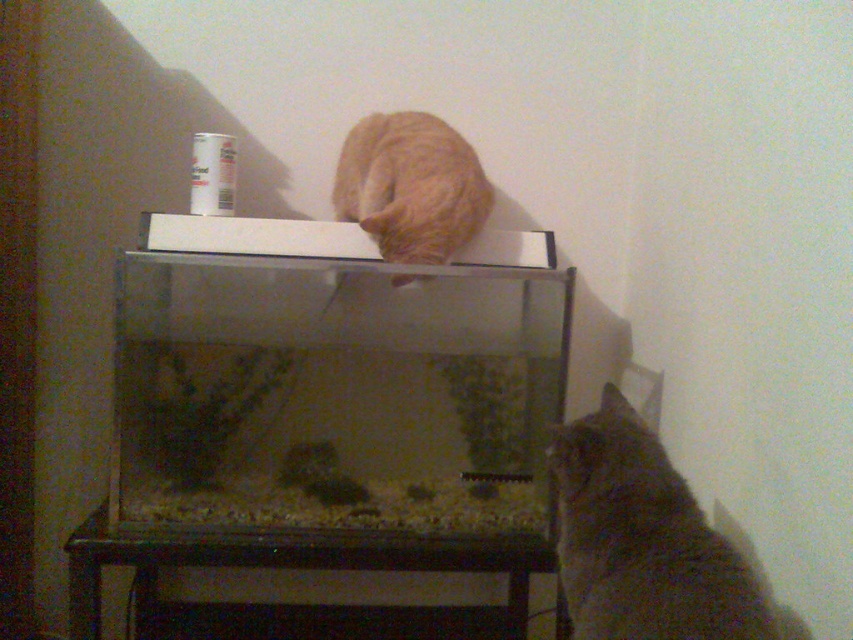
You are a cat owner who wants to place a new cat toy in the fish tank. The tank has two cats nearby, a fuzzy brown cat at lower right and an orange fur cat at upper center. Which cat is positioned to the right side of the other?

The fuzzy brown cat at lower right is to the right of the orange fur cat at upper center.

You are standing at a distance of 4.08 feet from the point marked at coordinates (584, 508) in the image. If you want to place a small plant pot exactly at that point, which object in the scene would it be closest to?

The point marked at coordinates (584, 508) is 4.08 feet away from you. Based on the scene description, the closest object would be the cylindrical canister on the white shelf atop the fish tank, as it is positioned near the top right area where the coordinates might align.

You are a cat owner who wants to ensure your cats are safe around the fish tank. You see a fuzzy brown cat at lower right and an orange fur cat at upper center. Which cat is closer to the fish tank?

The fuzzy brown cat at lower right is closer to the fish tank than the orange fur cat at upper center because it is positioned lower and nearer to the tank compared to the orange fur cat at upper center which is higher up.